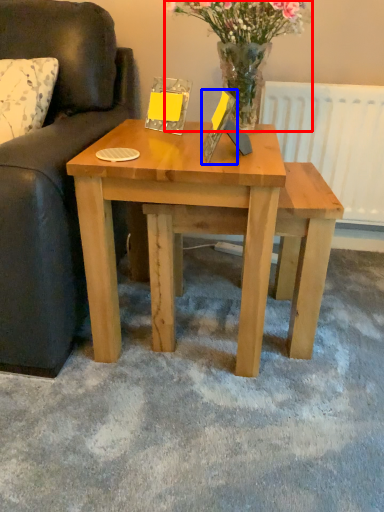
Question: Which of the following is the closest to the observer, floral arrangement (highlighted by a red box) or picture frame (highlighted by a blue box)?

Choices:
 (A) floral arrangement
 (B) picture frame

Answer: (B)